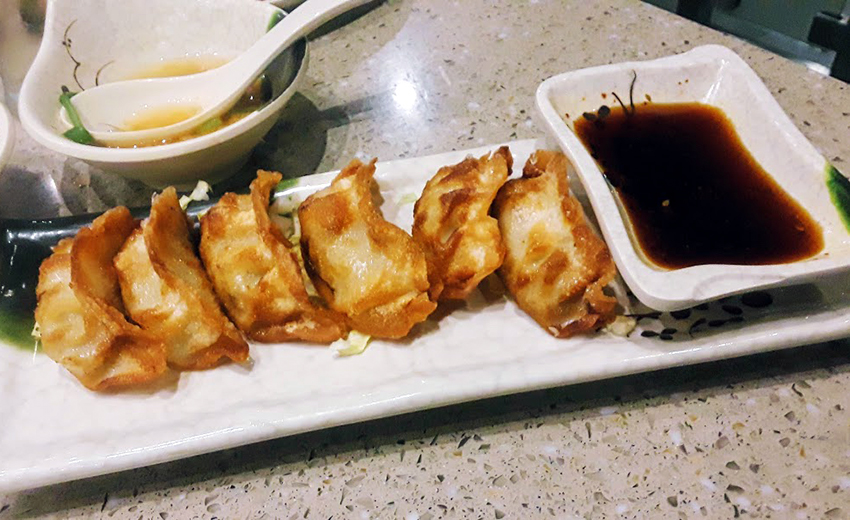
At what (x,y) coordinates should I click in order to perform the action: click on plate. Please return your answer as a coordinate pair (x, y). The height and width of the screenshot is (520, 850). Looking at the image, I should click on coord(337,370).